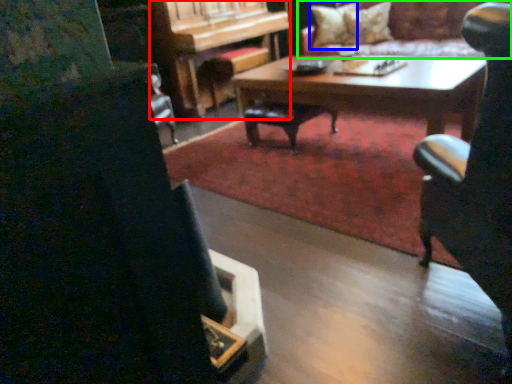
Question: Based on their relative distances, which object is nearer to piano (highlighted by a red box)? Choose from pillow (highlighted by a blue box) and couch (highlighted by a green box).

Choices:
 (A) pillow
 (B) couch

Answer: (A)